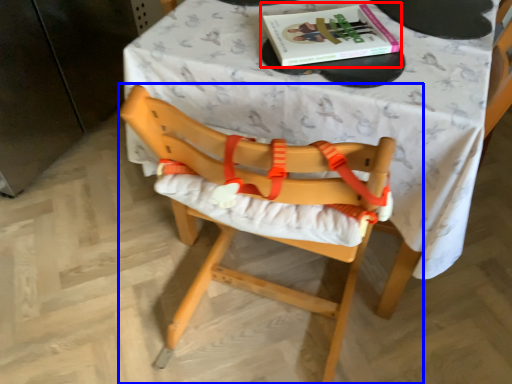
Question: Among these objects, which one is nearest to the camera, book (highlighted by a red box) or chair (highlighted by a blue box)?

Choices:
 (A) book
 (B) chair

Answer: (B)